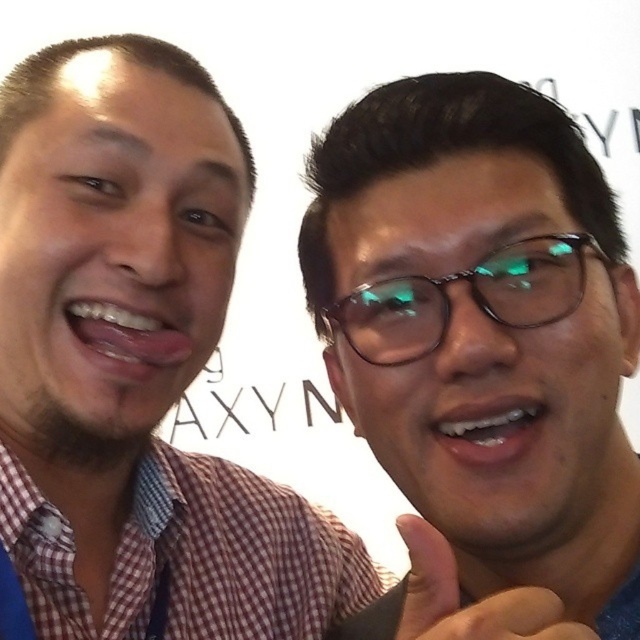
Question: Which of the following is the farthest from the observer?

Choices:
 (A) (134, 406)
 (B) (509, 268)

Answer: (A)

Question: Does checkered shirt at left have a larger size compared to green reflective glasses at center?

Choices:
 (A) no
 (B) yes

Answer: (B)

Question: Does red checkered shirt at left come behind green reflective glasses at center?

Choices:
 (A) no
 (B) yes

Answer: (B)

Question: Does matte black glasses at upper right lie behind green reflective glasses at center?

Choices:
 (A) yes
 (B) no

Answer: (B)

Question: Based on their relative distances, which object is nearer to the green reflective glasses at center?

Choices:
 (A) red checkered shirt at left
 (B) matte black glasses at upper right
 (C) checkered shirt at left

Answer: (B)

Question: Considering the real-world distances, which object is farthest from the matte black glasses at upper right?

Choices:
 (A) checkered shirt at left
 (B) green reflective glasses at center
 (C) red checkered shirt at left

Answer: (C)